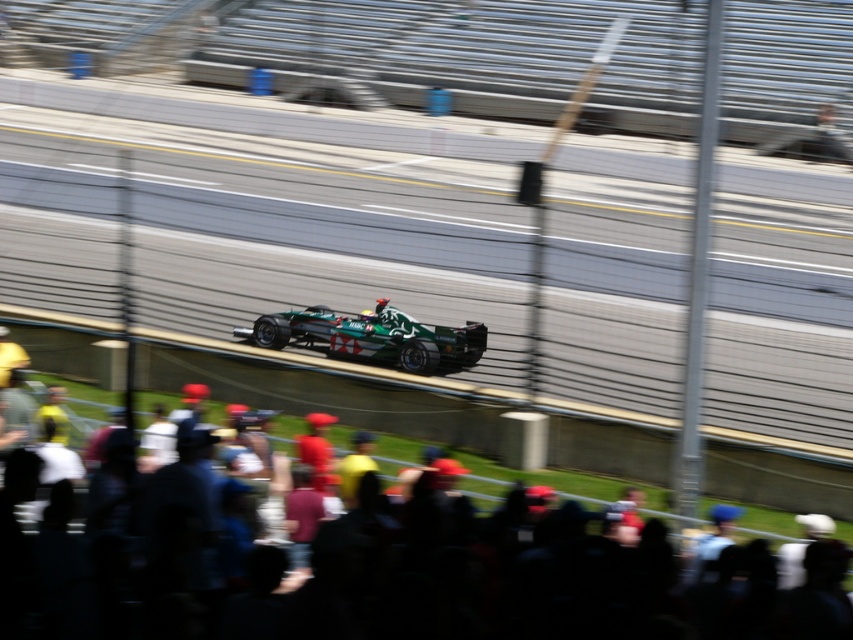
Question: Does dark blue fabric crowd at lower center appear over green matte race car at center?

Choices:
 (A) no
 (B) yes

Answer: (A)

Question: Which point appears closest to the camera in this image?

Choices:
 (A) (724, 589)
 (B) (425, 348)

Answer: (A)

Question: Can you confirm if dark blue fabric crowd at lower center is positioned to the right of green matte race car at center?

Choices:
 (A) yes
 (B) no

Answer: (A)

Question: Which point is closer to the camera?

Choices:
 (A) (415, 369)
 (B) (434, 588)

Answer: (B)

Question: Does dark blue fabric crowd at lower center appear over green matte race car at center?

Choices:
 (A) no
 (B) yes

Answer: (A)